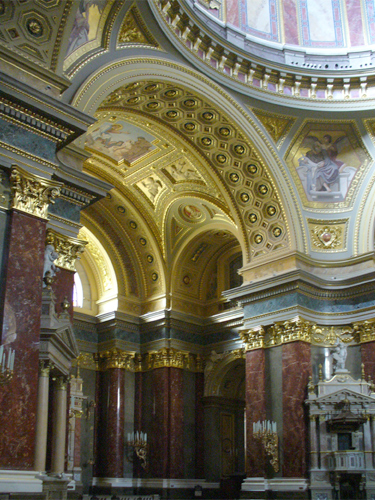
Locate an element on the screen. The height and width of the screenshot is (500, 375). candalabras is located at coordinates (134, 440), (267, 425).